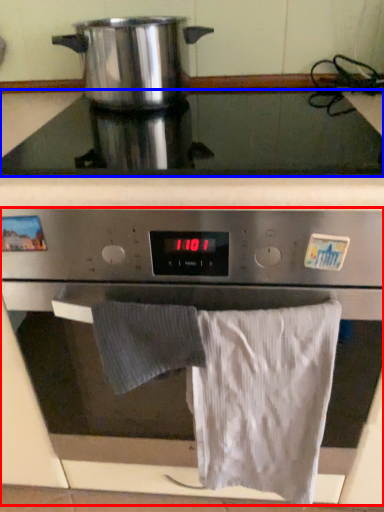
Question: Which object appears closest to the camera in this image, oven (highlighted by a red box) or gas stove (highlighted by a blue box)?

Choices:
 (A) oven
 (B) gas stove

Answer: (A)